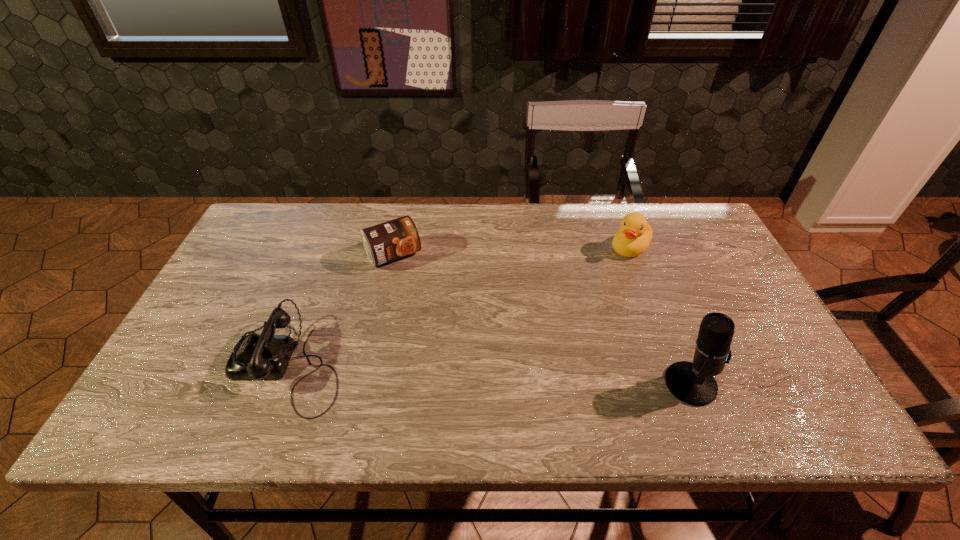
You are a GUI agent. You are given a task and a screenshot of the screen. Output one action in this format:
    pyautogui.click(x=<x>, y=<y>)
    Task: Click on the vacant area between the duck and the tallest object
    The width and height of the screenshot is (960, 540).
    Given the screenshot: What is the action you would take?
    pyautogui.click(x=660, y=316)

Where is `free space between the can and the duck`? free space between the can and the duck is located at coordinates (512, 252).

Identify the location of free space between the tallest object and the telephone. This screenshot has height=540, width=960. (490, 374).

Locate an element on the screen. free point between the third shortest object and the tallest object is located at coordinates (660, 316).

This screenshot has width=960, height=540. I want to click on the second closest object relative to the tallest object, so click(x=385, y=242).

Find the location of a particular element. The width and height of the screenshot is (960, 540). the second closest object relative to the microphone is located at coordinates (385, 242).

Identify the location of vacant point that satisfies the following two spatial constraints: 1. on the front side of the second tallest object; 2. on the left side of the tallest object. (682, 384).

Locate an element on the screen. The width and height of the screenshot is (960, 540). free spot that satisfies the following two spatial constraints: 1. on the front side of the duck; 2. on the left side of the tallest object is located at coordinates (682, 384).